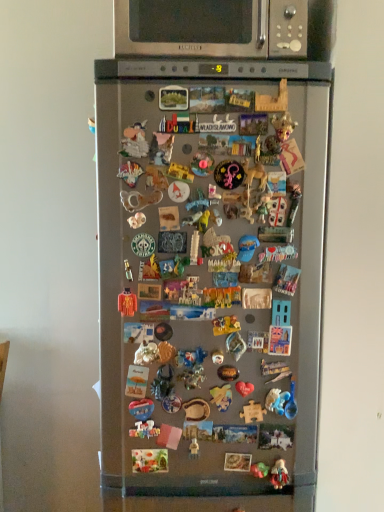
Question: Is metallic gold figurine at center, which is counted as the second toy, starting from the left, shorter than wooden puzzle piece at center, the 3th toy ordered from the bottom?

Choices:
 (A) yes
 (B) no

Answer: (A)

Question: From the image's perspective, does metallic gold figurine at center, the 2th toy in the bottom-to-top sequence, appear lower than wooden puzzle piece at center, the 3th toy when ordered from left to right?

Choices:
 (A) no
 (B) yes

Answer: (B)

Question: From a real-world perspective, is metallic gold figurine at center, the 2th toy in the bottom-to-top sequence, positioned under wooden puzzle piece at center, the second toy when ordered from right to left, based on gravity?

Choices:
 (A) no
 (B) yes

Answer: (B)

Question: Does metallic gold figurine at center, the 3th toy when ordered from top to bottom, have a smaller size compared to wooden puzzle piece at center, the 3th toy ordered from the bottom?

Choices:
 (A) yes
 (B) no

Answer: (A)

Question: Considering the relative positions of metallic gold figurine at center, the 2th toy in the bottom-to-top sequence, and wooden puzzle piece at center, the 2th toy from the top, in the image provided, is metallic gold figurine at center, the 2th toy in the bottom-to-top sequence, to the left of wooden puzzle piece at center, the 2th toy from the top, from the viewer's perspective?

Choices:
 (A) no
 (B) yes

Answer: (B)

Question: Would you consider metallic gold figurine at center, which is counted as the second toy, starting from the left, to be distant from wooden puzzle piece at center, the 3th toy ordered from the bottom?

Choices:
 (A) no
 (B) yes

Answer: (A)

Question: Is matte plastic figurine at lower center, the 4th toy when ordered from left to right, placed right next to satin silver microwave at upper center?

Choices:
 (A) no
 (B) yes

Answer: (A)

Question: Is matte plastic figurine at lower center, arranged as the first toy when viewed from the right, closer to camera compared to satin silver microwave at upper center?

Choices:
 (A) yes
 (B) no

Answer: (B)

Question: Is matte plastic figurine at lower center, the 4th toy from the top, wider than satin silver microwave at upper center?

Choices:
 (A) yes
 (B) no

Answer: (B)

Question: Considering the relative positions of matte plastic figurine at lower center, arranged as the first toy when viewed from the right, and satin silver microwave at upper center in the image provided, is matte plastic figurine at lower center, arranged as the first toy when viewed from the right, to the right of satin silver microwave at upper center from the viewer's perspective?

Choices:
 (A) yes
 (B) no

Answer: (A)

Question: From a real-world perspective, is matte plastic figurine at lower center, arranged as the first toy when viewed from the right, physically below satin silver microwave at upper center?

Choices:
 (A) yes
 (B) no

Answer: (A)

Question: Is matte plastic figurine at lower center, arranged as the first toy when viewed from the right, facing away from satin silver microwave at upper center?

Choices:
 (A) no
 (B) yes

Answer: (A)

Question: Can you confirm if orange fabric toy at center, arranged as the 4th toy when ordered from the bottom, is taller than metallic gold figurine at center, the 3th toy when ordered from right to left?

Choices:
 (A) no
 (B) yes

Answer: (B)